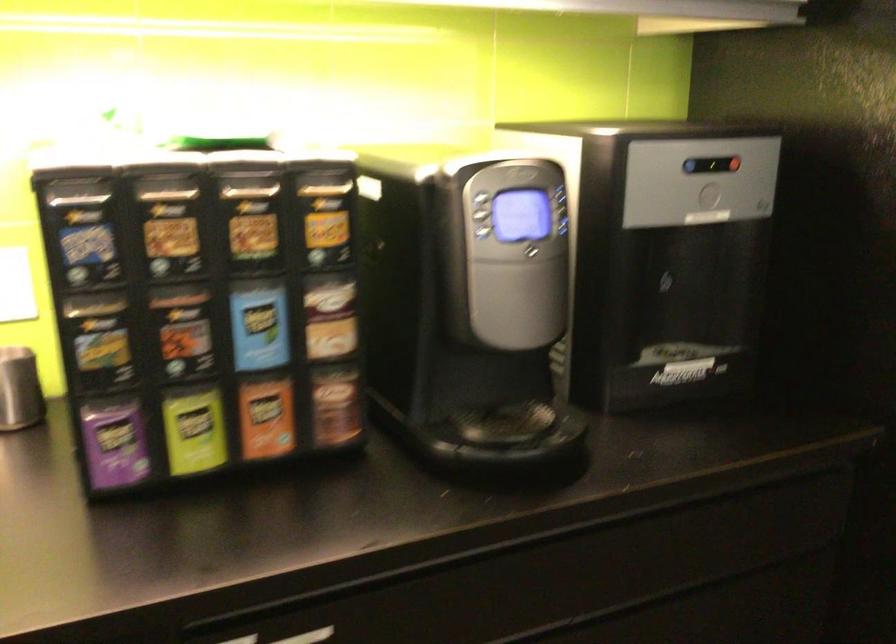
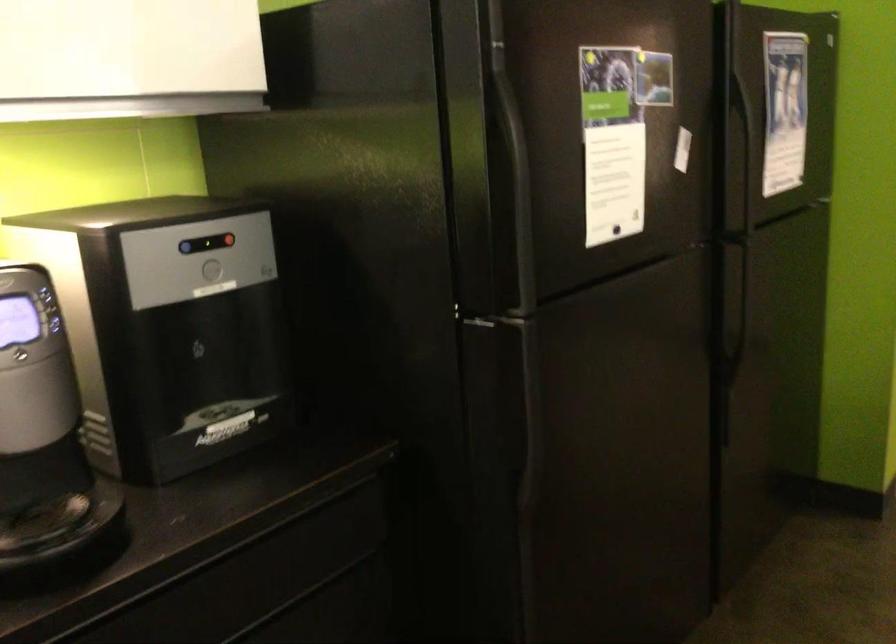
In the second image, find the point that corresponds to (693,162) in the first image.

(186, 247)